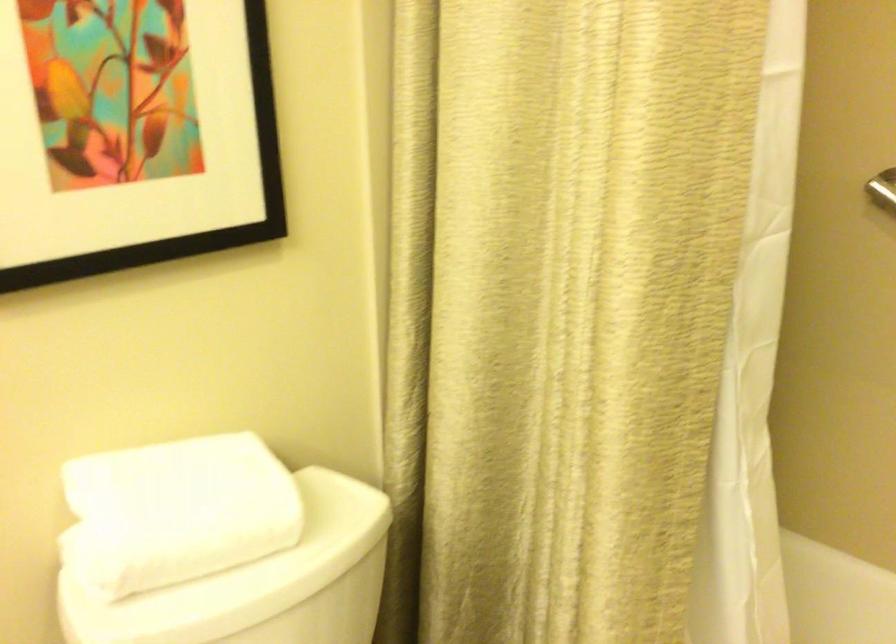
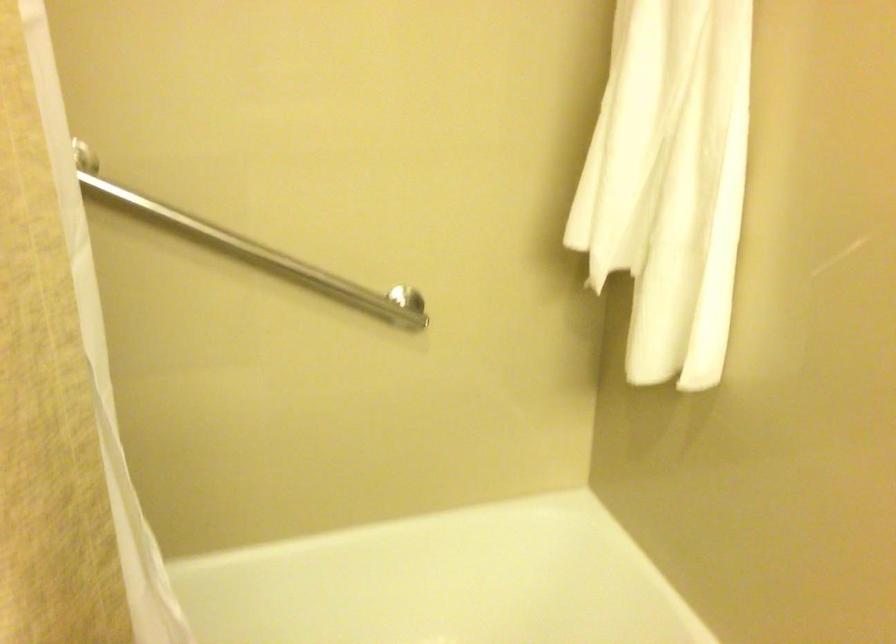
Question: The camera is either moving clockwise (left) or counter-clockwise (right) around the object. The first image is from the beginning of the video and the second image is from the end. Is the camera moving left or right when shooting the video?

Choices:
 (A) Left
 (B) Right

Answer: (A)